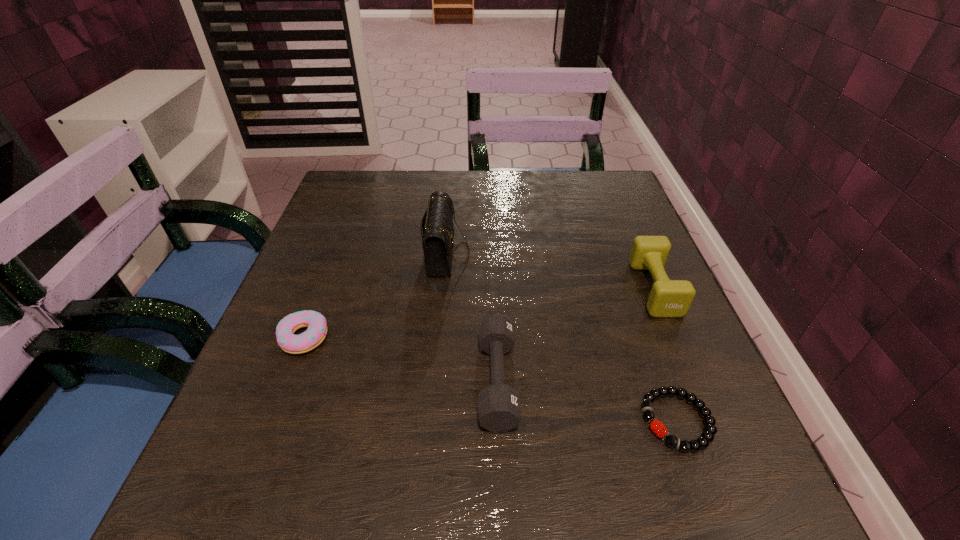
Find the location of a particular element. unoccupied area between the clutch bag and the fourth tallest object is located at coordinates (375, 295).

The image size is (960, 540). Find the location of `unoccupied position between the shortest object and the clutch bag`. unoccupied position between the shortest object and the clutch bag is located at coordinates (562, 336).

What are the coordinates of `free area in between the tallest object and the shortest object` in the screenshot? It's located at (562, 336).

Where is `object that is the third closest to the shortest object`? The width and height of the screenshot is (960, 540). object that is the third closest to the shortest object is located at coordinates (437, 230).

Image resolution: width=960 pixels, height=540 pixels. Identify the location of object that is the closest to the third tallest object. (437, 230).

You are a GUI agent. You are given a task and a screenshot of the screen. Output one action in this format:
    pyautogui.click(x=<x>, y=<y>)
    Task: Click on the free location that satisfies the following two spatial constraints: 1. on the front flap of the second object from left to right; 2. on the left side of the bracelet
    The image size is (960, 540).
    Given the screenshot: What is the action you would take?
    pyautogui.click(x=432, y=421)

At what (x,y) coordinates should I click in order to perform the action: click on blank area in the image that satisfies the following two spatial constraints: 1. on the front side of the bracelet; 2. on the right side of the nearer dumbbell. Please return your answer as a coordinate pair (x, y). Image resolution: width=960 pixels, height=540 pixels. Looking at the image, I should click on (498, 421).

I want to click on free location that satisfies the following two spatial constraints: 1. on the front flap of the clutch bag; 2. on the left side of the farther dumbbell, so click(x=444, y=288).

Find the location of a particular element. Image resolution: width=960 pixels, height=540 pixels. vacant space that satisfies the following two spatial constraints: 1. on the front flap of the fourth object from right to left; 2. on the left side of the shorter dumbbell is located at coordinates (435, 380).

Find the location of a particular element. This screenshot has height=540, width=960. vacant region that satisfies the following two spatial constraints: 1. on the front flap of the right dumbbell; 2. on the right side of the clutch bag is located at coordinates (444, 288).